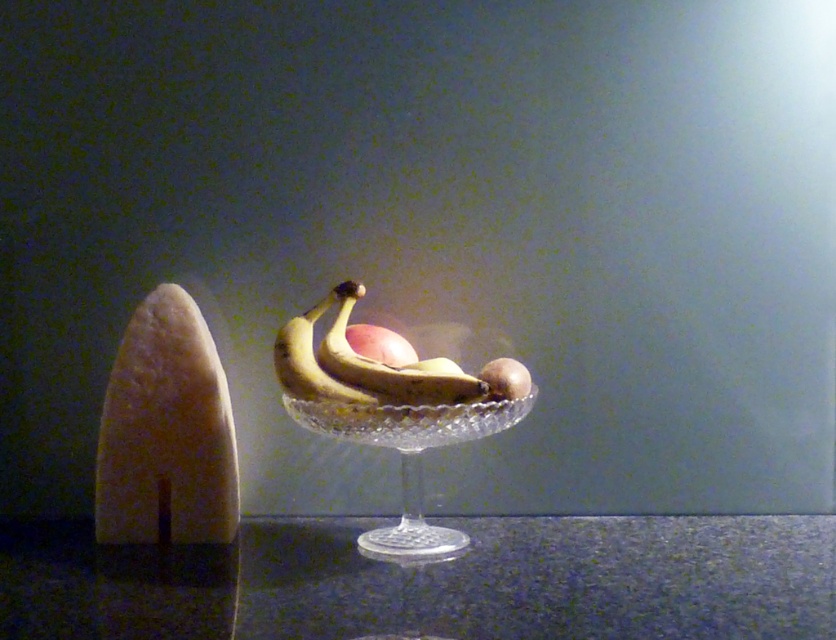
Which is above, glossy apple at center or smooth brown potato at center?

glossy apple at center is higher up.

How much distance is there between glossy apple at center and smooth brown potato at center?

glossy apple at center is 4.72 inches from smooth brown potato at center.

Who is more distant from viewer, [386,348] or [521,378]?

Point [386,348]

Locate an element on the screen. glossy apple at center is located at coordinates (380, 344).

Which is below, yellow matte bananas at center or smooth brown potato at center?

Positioned lower is smooth brown potato at center.

Who is taller, yellow matte bananas at center or smooth brown potato at center?

With more height is yellow matte bananas at center.

Find the location of a particular element. Image resolution: width=836 pixels, height=640 pixels. yellow matte bananas at center is located at coordinates (360, 364).

Which is more to the right, clear glass bowl at center or yellow matte bananas at center?

From the viewer's perspective, clear glass bowl at center appears more on the right side.

Which is below, clear glass bowl at center or yellow matte bananas at center?

clear glass bowl at center

This screenshot has width=836, height=640. I want to click on clear glass bowl at center, so click(409, 458).

Locate an element on the screen. clear glass bowl at center is located at coordinates (409, 458).